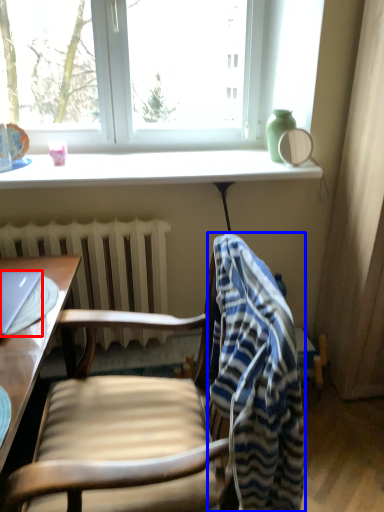
Question: Which point is further to the camera, laptop (highlighted by a red box) or bath towel (highlighted by a blue box)?

Choices:
 (A) laptop
 (B) bath towel

Answer: (A)